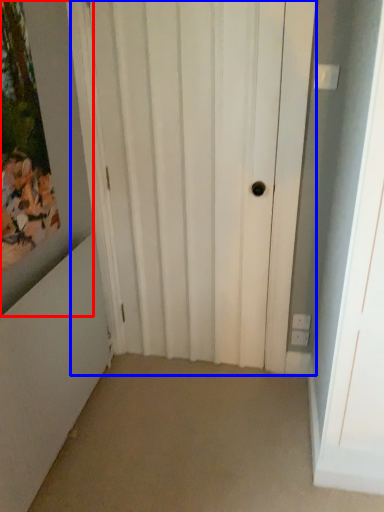
Question: Which point is further to the camera, picture frame (highlighted by a red box) or door (highlighted by a blue box)?

Choices:
 (A) picture frame
 (B) door

Answer: (B)